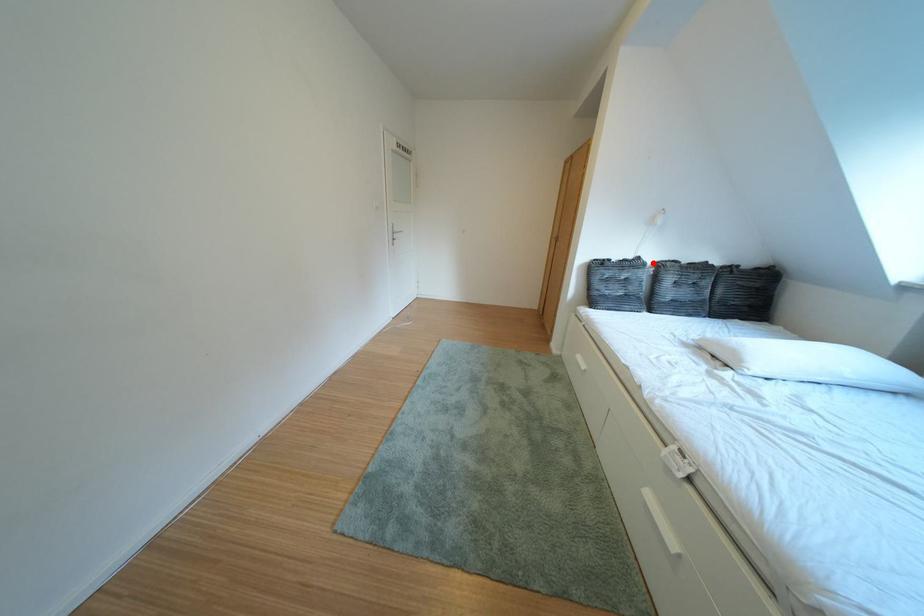
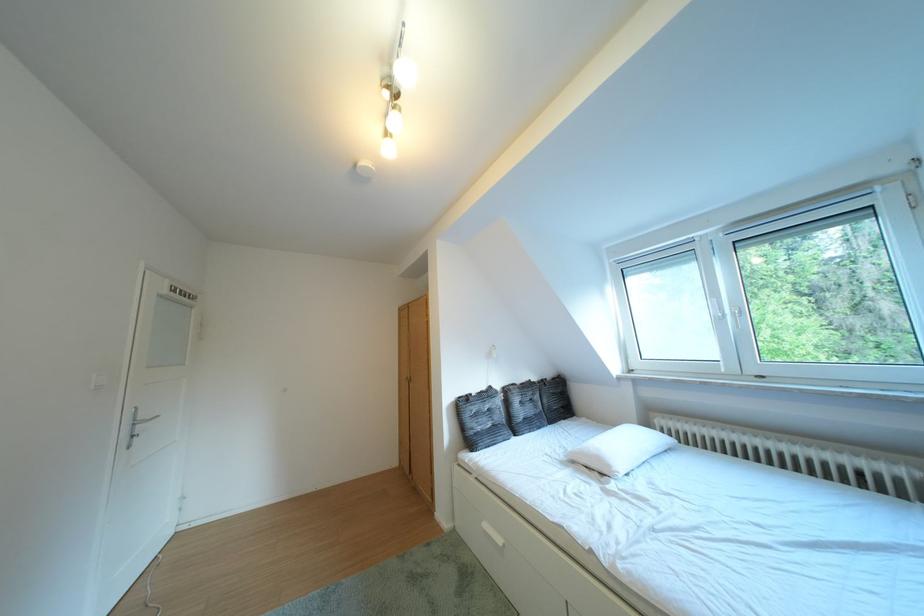
Locate, in the second image, the point that corresponds to the highlighted location in the first image.

(504, 392)